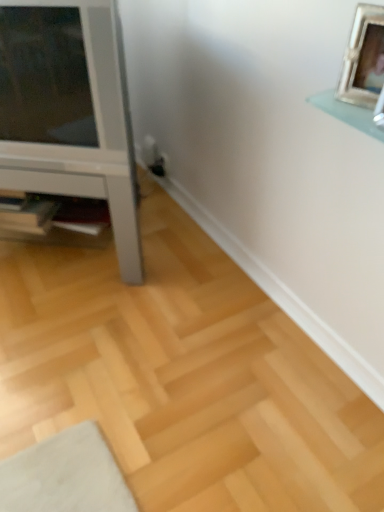
Locate an element on the screen. The width and height of the screenshot is (384, 512). vacant area located to the right-hand side of white glossy tv stand at left is located at coordinates (198, 269).